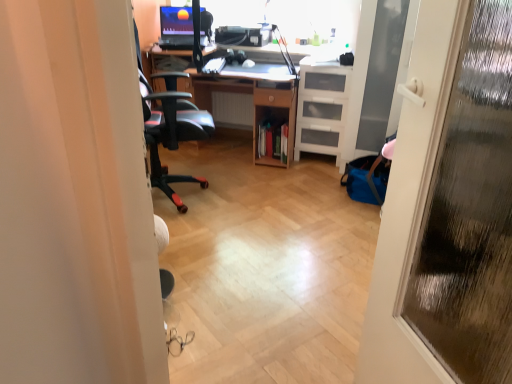
Question: Can you confirm if transparent glass screen door at right is positioned to the right of matte black monitor at upper center?

Choices:
 (A) no
 (B) yes

Answer: (B)

Question: Considering the relative sizes of transparent glass screen door at right and matte black monitor at upper center in the image provided, is transparent glass screen door at right bigger than matte black monitor at upper center?

Choices:
 (A) yes
 (B) no

Answer: (A)

Question: Is transparent glass screen door at right not inside matte black monitor at upper center?

Choices:
 (A) yes
 (B) no

Answer: (A)

Question: Does transparent glass screen door at right have a smaller size compared to matte black monitor at upper center?

Choices:
 (A) no
 (B) yes

Answer: (A)

Question: Can you see transparent glass screen door at right touching matte black monitor at upper center?

Choices:
 (A) no
 (B) yes

Answer: (A)

Question: From a real-world perspective, relative to matte black monitor at upper center, is white plastic radiator at center vertically above or below?

Choices:
 (A) below
 (B) above

Answer: (A)

Question: From the image's perspective, is white plastic radiator at center located above or below matte black monitor at upper center?

Choices:
 (A) above
 (B) below

Answer: (B)

Question: From their relative heights in the image, would you say white plastic radiator at center is taller or shorter than matte black monitor at upper center?

Choices:
 (A) tall
 (B) short

Answer: (B)

Question: Does point (217, 125) appear closer or farther from the camera than point (177, 31)?

Choices:
 (A) closer
 (B) farther

Answer: (B)

Question: Is point (331, 91) positioned closer to the camera than point (214, 99)?

Choices:
 (A) farther
 (B) closer

Answer: (B)

Question: Is white plastic drawers at right in front of or behind white plastic radiator at center in the image?

Choices:
 (A) behind
 (B) front

Answer: (B)

Question: From the image's perspective, is white plastic drawers at right above or below white plastic radiator at center?

Choices:
 (A) above
 (B) below

Answer: (B)

Question: Considering the positions of white plastic drawers at right and white plastic radiator at center in the image, is white plastic drawers at right wider or thinner than white plastic radiator at center?

Choices:
 (A) wide
 (B) thin

Answer: (A)

Question: Is white plastic radiator at center in front of or behind transparent glass screen door at right in the image?

Choices:
 (A) front
 (B) behind

Answer: (B)

Question: From a real-world perspective, relative to transparent glass screen door at right, is white plastic radiator at center vertically above or below?

Choices:
 (A) above
 (B) below

Answer: (B)